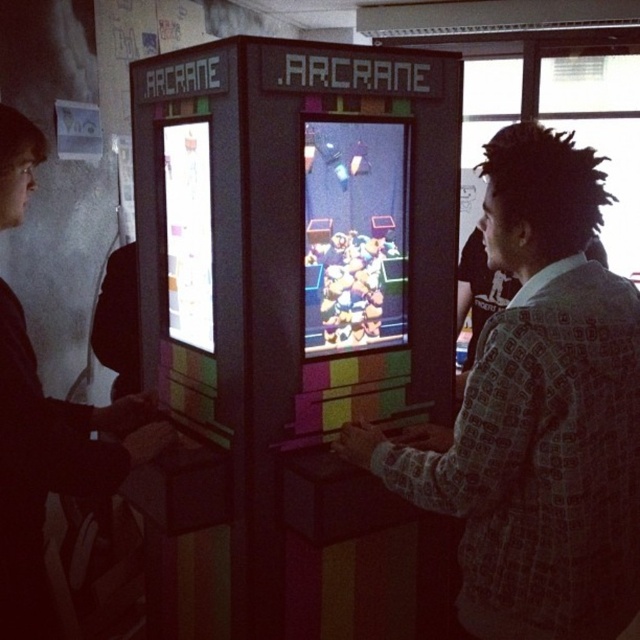
From the picture: You are standing in front of the arcade crane machines and want to reach a point that is exactly 1.11 meters away from you. Can you confirm if the point labeled as point (x=499, y=348) is at that distance?

Yes, the point (x=499, y=348) is exactly 1.11 meters away from the viewer, so you can reach it.

You are standing in an arcade and see two people playing the crane games. One is wearing a patterned shirt at center, and the other is wearing a dark gray sweater at left. Based on their clothing, which person is taller?

The patterned shirt at center is taller than dark gray sweater at left, so the person wearing the patterned shirt at center is taller.

You are standing in front of the two arcade crane machines. There is a point marked at coordinates (x=538, y=413). Which object from the scene is located at this point?

The point at (x=538, y=413) corresponds to the patterned shirt at center.